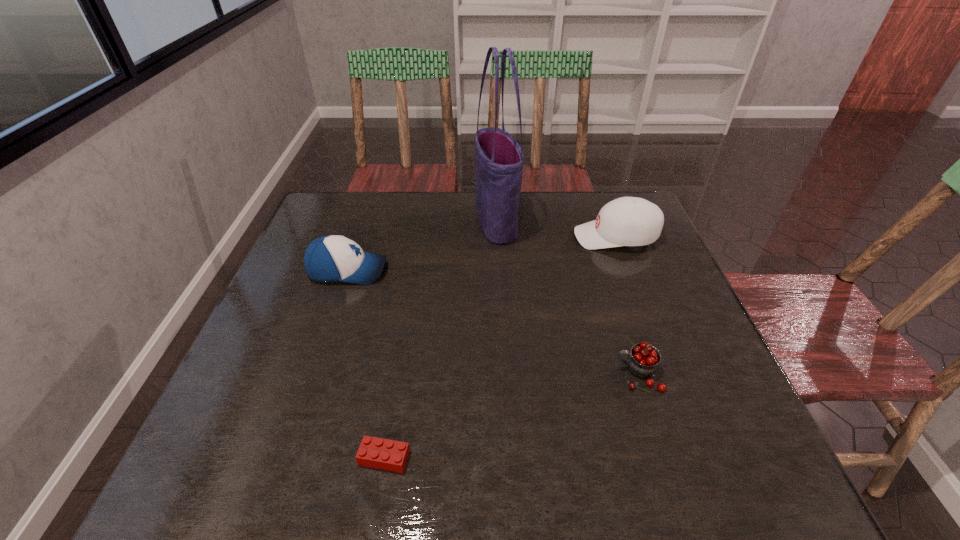
This screenshot has height=540, width=960. I want to click on the third object from left to right, so click(x=499, y=159).

Locate an element on the screen. This screenshot has width=960, height=540. the tallest object is located at coordinates (499, 159).

Where is `the farther baseball cap`? The height and width of the screenshot is (540, 960). the farther baseball cap is located at coordinates (627, 221).

This screenshot has width=960, height=540. In order to click on the leftmost object in this screenshot , I will do `click(332, 258)`.

You are a GUI agent. You are given a task and a screenshot of the screen. Output one action in this format:
    pyautogui.click(x=<x>, y=<y>)
    Task: Click on the third farthest object
    Image resolution: width=960 pixels, height=540 pixels.
    Given the screenshot: What is the action you would take?
    pyautogui.click(x=332, y=258)

Find the location of a particular element. The image size is (960, 540). the fourth farthest object is located at coordinates (643, 361).

Locate an element on the screen. Image resolution: width=960 pixels, height=540 pixels. Lego is located at coordinates (374, 452).

This screenshot has width=960, height=540. I want to click on the shortest object, so click(374, 452).

Identify the location of vacant space situated on the front of the tote bag. This screenshot has width=960, height=540. (502, 360).

The image size is (960, 540). What are the coordinates of `vacant space located 0.360m on the front-facing side of the right baseball cap` in the screenshot? It's located at (448, 237).